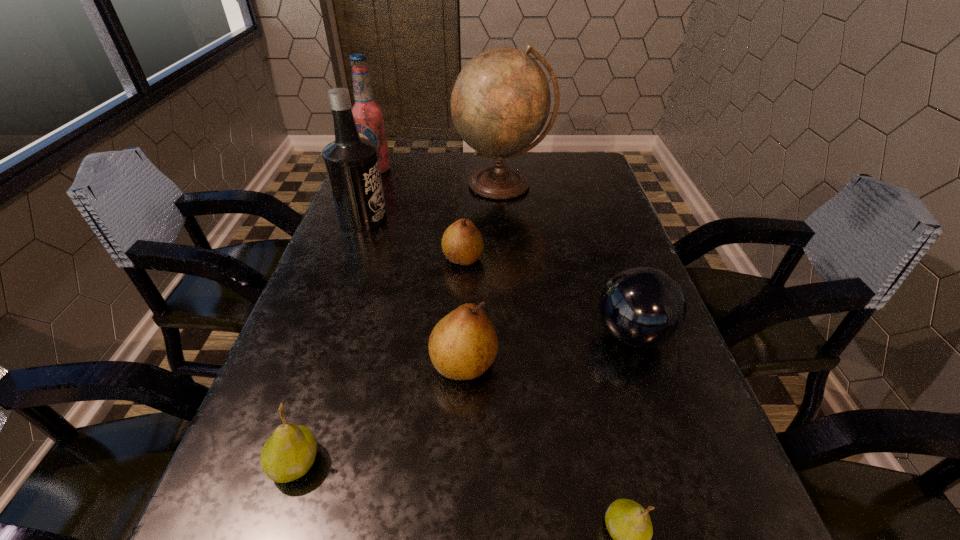
At what (x,y) coordinates should I click in order to perform the action: click on free space at the far right corner of the desktop. Please return your answer as a coordinate pair (x, y). The height and width of the screenshot is (540, 960). Looking at the image, I should click on (580, 163).

I want to click on vacant point located between the black liquor and the globe, so coord(433,202).

What are the coordinates of `vacant point located between the black liquor and the black bowling ball` in the screenshot? It's located at (498, 277).

Locate an element on the screen. free point between the smaller brown pear and the left green pear is located at coordinates (379, 361).

This screenshot has width=960, height=540. I want to click on free point between the farther green pear and the smaller brown pear, so click(379, 361).

Where is `object that stands as the second closest to the fifth nearest object`? The width and height of the screenshot is (960, 540). object that stands as the second closest to the fifth nearest object is located at coordinates (500, 102).

Choose which object is the nearest neighbor to the bigger green pear. Please provide its 2D coordinates. Your answer should be formatted as a tuple, i.e. [(x, y)], where the tuple contains the x and y coordinates of a point satisfying the conditions above.

[(463, 345)]

Locate which pear ranks in proximity to the globe. Please provide its 2D coordinates. Your answer should be formatted as a tuple, i.e. [(x, y)], where the tuple contains the x and y coordinates of a point satisfying the conditions above.

[(462, 243)]

Locate an element on the screen. pear identified as the third closest to the farther brown pear is located at coordinates (628, 523).

At what (x,y) coordinates should I click in order to perform the action: click on brown pear that is the second closest one to the bowling ball. Please return your answer as a coordinate pair (x, y). This screenshot has height=540, width=960. Looking at the image, I should click on (462, 243).